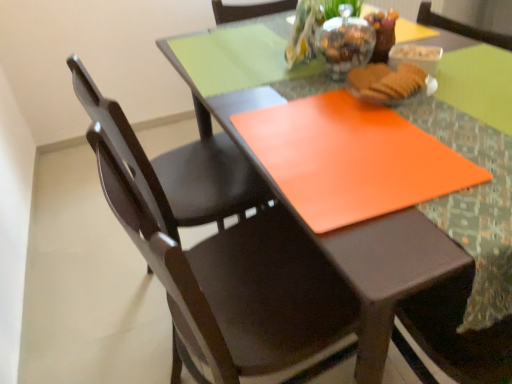
Where is `free area in between orange matte placemat at center and translucent glass vase at upper center`? free area in between orange matte placemat at center and translucent glass vase at upper center is located at coordinates (336, 107).